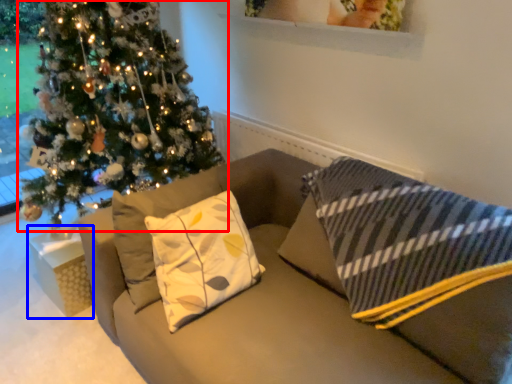
Question: Among these objects, which one is farthest to the camera, christmas tree (highlighted by a red box) or furniture (highlighted by a blue box)?

Choices:
 (A) christmas tree
 (B) furniture

Answer: (B)